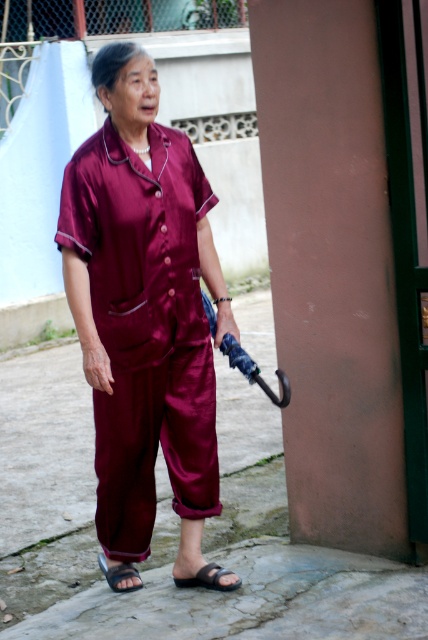
Does maroon satin pajamas at center have a lesser height compared to black leather sandal at lower center?

Incorrect, maroon satin pajamas at center's height does not fall short of black leather sandal at lower center's.

Which is in front, point (211, 362) or point (104, 570)?

Point (211, 362)

In order to click on maroon satin pajamas at center in this screenshot , I will do `click(143, 310)`.

I want to click on maroon satin pajamas at center, so click(143, 310).

This screenshot has height=640, width=428. What are the coordinates of `maroon satin pajamas at center` in the screenshot? It's located at (143, 310).

Find the location of a particular element. maroon satin pajamas at center is located at coordinates (143, 310).

Which is in front, point (202, 570) or point (121, 589)?

Point (202, 570)

Can you confirm if black rubber sandal at lower center is bigger than black leather sandal at lower center?

Actually, black rubber sandal at lower center might be smaller than black leather sandal at lower center.

Who is more distant from viewer, (226,586) or (130,568)?

Positioned behind is point (130,568).

The image size is (428, 640). I want to click on black rubber sandal at lower center, so click(208, 579).